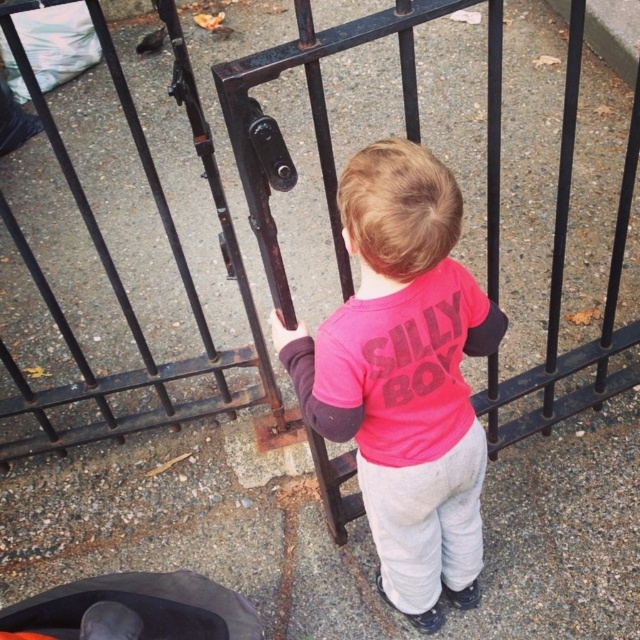
Question: Which point is closer to the camera?

Choices:
 (A) (404, 474)
 (B) (180, 616)
 (C) (273, 404)

Answer: (A)

Question: Which object appears closest to the camera in this image?

Choices:
 (A) pink matte shirt at center
 (B) black metal gate at center

Answer: (B)

Question: Does black metal gate at center appear over pink matte shirt at center?

Choices:
 (A) yes
 (B) no

Answer: (A)

Question: Where is black metal gate at center located in relation to pink matte shirt at center in the image?

Choices:
 (A) below
 (B) above

Answer: (B)

Question: Which point appears closest to the camera in this image?

Choices:
 (A) [x=116, y=614]
 (B) [x=195, y=365]

Answer: (A)

Question: Is the position of black metal gate at center more distant than that of pink matte shirt at center?

Choices:
 (A) no
 (B) yes

Answer: (A)